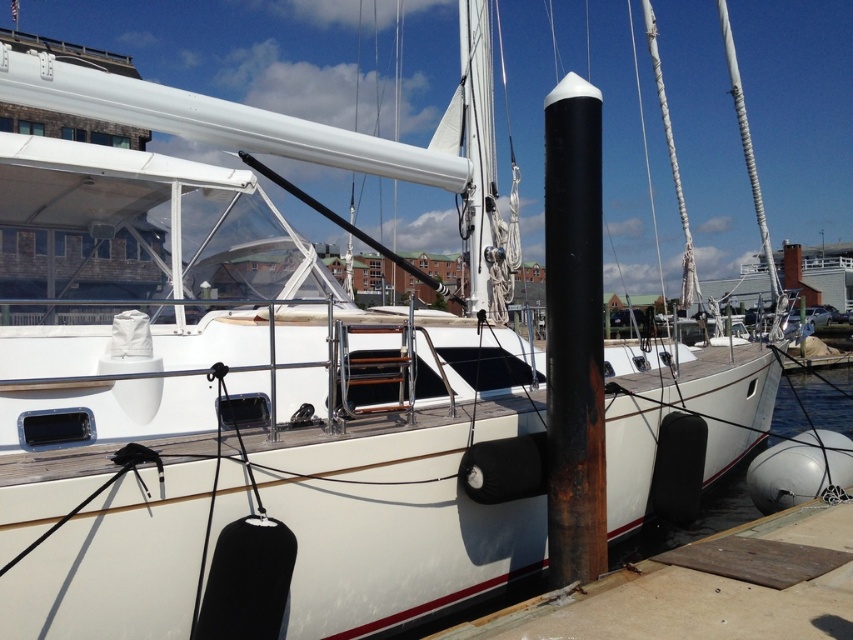
Looking at this image, you are standing on the dock looking at the white sailboat. There are two points marked on the boat. Which point is closer to you, point (757, 584) or point (585, 324)?

Point (757, 584) is closer to the viewer than point (585, 324).

Consider the image. You are standing on the dock and want to board the sailboat. You see the wooden at lower right and the rusty metal pole at center. Which object should you avoid stepping on to reach the boat safely?

You should avoid stepping on the wooden at lower right because it is in front of the rusty metal pole at center, which might be part of the dock infrastructure. Stepping on the wooden object could obstruct your path or be unstable, so it is safer to step around it to reach the boat.